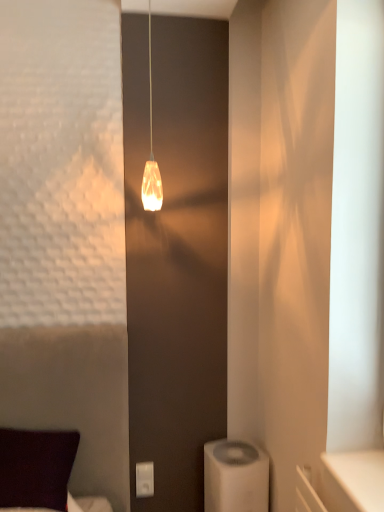
What do you see at coordinates (235, 477) in the screenshot? Image resolution: width=384 pixels, height=512 pixels. I see `white plastic air purifier at lower right` at bounding box center [235, 477].

What do you see at coordinates (144, 479) in the screenshot? I see `white plastic/light switch at lower center` at bounding box center [144, 479].

Locate an element on the screen. The image size is (384, 512). white plastic air purifier at lower right is located at coordinates (235, 477).

Does white plastic/light switch at lower center have a lesser height compared to white plastic air purifier at lower right?

Yes, white plastic/light switch at lower center is shorter than white plastic air purifier at lower right.

Measure the distance between white plastic/light switch at lower center and white plastic air purifier at lower right.

white plastic/light switch at lower center is 16.67 inches from white plastic air purifier at lower right.

Locate an element on the screen. light switch behind the white plastic air purifier at lower right is located at coordinates (144, 479).

Does point (144, 486) appear closer or farther from the camera than point (242, 510)?

Point (144, 486).

Can you see white plastic air purifier at lower right touching dark purple fabric pillow at lower left?

No.

Would you say white plastic air purifier at lower right is inside or outside dark purple fabric pillow at lower left?

white plastic air purifier at lower right is not enclosed by dark purple fabric pillow at lower left.

Visually, is white plastic air purifier at lower right positioned to the left or to the right of dark purple fabric pillow at lower left?

Based on their positions, white plastic air purifier at lower right is located to the right of dark purple fabric pillow at lower left.

From the image's perspective, which is below, white plastic air purifier at lower right or dark purple fabric pillow at lower left?

From the image's view, white plastic air purifier at lower right is below.

Considering the positions of point (143, 185) and point (148, 483), is point (143, 185) closer or farther from the camera than point (148, 483)?

Point (143, 185) appears to be closer to the viewer than point (148, 483).

Considering the sizes of translucent glass pendant light at center and white plastic/light switch at lower center in the image, is translucent glass pendant light at center wider or thinner than white plastic/light switch at lower center?

In the image, translucent glass pendant light at center appears to be wider than white plastic/light switch at lower center.

Looking at the image, does translucent glass pendant light at center seem bigger or smaller compared to white plastic/light switch at lower center?

translucent glass pendant light at center is bigger than white plastic/light switch at lower center.

How distant is translucent glass pendant light at center from white plastic/light switch at lower center?

The distance of translucent glass pendant light at center from white plastic/light switch at lower center is 4.33 feet.

From a real-world perspective, is translucent glass pendant light at center beneath dark purple fabric pillow at lower left?

No, from a real-world perspective, translucent glass pendant light at center is not beneath dark purple fabric pillow at lower left.

Does translucent glass pendant light at center touch dark purple fabric pillow at lower left?

No, translucent glass pendant light at center is not in contact with dark purple fabric pillow at lower left.

Does translucent glass pendant light at center have a lesser height compared to dark purple fabric pillow at lower left?

Incorrect, the height of translucent glass pendant light at center does not fall short of that of dark purple fabric pillow at lower left.

This screenshot has height=512, width=384. What are the coordinates of `pillow below the translucent glass pendant light at center (from the image's perspective)` in the screenshot? It's located at (36, 468).

From the image's perspective, between translucent glass pendant light at center and white plastic air purifier at lower right, which one is located above?

translucent glass pendant light at center, from the image's perspective.

Considering their positions, is translucent glass pendant light at center located in front of or behind white plastic air purifier at lower right?

Clearly, translucent glass pendant light at center is in front of white plastic air purifier at lower right.

Considering the relative positions of translucent glass pendant light at center and white plastic air purifier at lower right in the image provided, is translucent glass pendant light at center to the right of white plastic air purifier at lower right from the viewer's perspective?

Incorrect, translucent glass pendant light at center is not on the right side of white plastic air purifier at lower right.

Who is shorter, translucent glass pendant light at center or white plastic air purifier at lower right?

white plastic air purifier at lower right is shorter.

Which is behind, point (242, 494) or point (142, 465)?

The point (142, 465) is more distant.

Consider the image. Considering the relative sizes of white plastic air purifier at lower right and white plastic/light switch at lower center in the image provided, is white plastic air purifier at lower right taller than white plastic/light switch at lower center?

Yes, white plastic air purifier at lower right is taller than white plastic/light switch at lower center.

From the picture: Is white plastic air purifier at lower right inside the boundaries of white plastic/light switch at lower center, or outside?

white plastic air purifier at lower right is outside white plastic/light switch at lower center.

From a real-world perspective, is white plastic air purifier at lower right below translucent glass pendant light at center?

Yes, from a real-world perspective, white plastic air purifier at lower right is beneath translucent glass pendant light at center.

Locate an element on the screen. The image size is (384, 512). lamp that is in front of the white plastic air purifier at lower right is located at coordinates (151, 158).

Looking at this image, between white plastic air purifier at lower right and translucent glass pendant light at center, which one has larger size?

white plastic air purifier at lower right is bigger.

Is translucent glass pendant light at center completely or partially inside white plastic air purifier at lower right?

No, translucent glass pendant light at center is not surrounded by white plastic air purifier at lower right.

Find the location of a particular element. appliance in front of the white plastic/light switch at lower center is located at coordinates (235, 477).

Find the location of a particular element. pillow above the white plastic air purifier at lower right (from the image's perspective) is located at coordinates (36, 468).

Considering their positions, is white plastic/light switch at lower center positioned closer to white plastic air purifier at lower right than dark purple fabric pillow at lower left?

white plastic/light switch at lower center is closer to white plastic air purifier at lower right.

Considering their positions, is white plastic/light switch at lower center positioned closer to dark purple fabric pillow at lower left than translucent glass pendant light at center?

Based on the image, white plastic/light switch at lower center appears to be nearer to dark purple fabric pillow at lower left.

Based on their spatial positions, is white plastic air purifier at lower right or dark purple fabric pillow at lower left further from white plastic/light switch at lower center?

dark purple fabric pillow at lower left is further to white plastic/light switch at lower center.

Looking at the image, which one is located closer to white plastic air purifier at lower right, translucent glass pendant light at center or dark purple fabric pillow at lower left?

Among the two, dark purple fabric pillow at lower left is located nearer to white plastic air purifier at lower right.

Looking at the image, which one is located further to white plastic air purifier at lower right, dark purple fabric pillow at lower left or white plastic/light switch at lower center?

dark purple fabric pillow at lower left.

Estimate the real-world distances between objects in this image. Which object is closer to white plastic air purifier at lower right, white plastic/light switch at lower center or translucent glass pendant light at center?

white plastic/light switch at lower center.

From the image, which object appears to be nearer to dark purple fabric pillow at lower left, white plastic/light switch at lower center or white plastic air purifier at lower right?

white plastic/light switch at lower center.

Estimate the real-world distances between objects in this image. Which object is further from white plastic/light switch at lower center, dark purple fabric pillow at lower left or translucent glass pendant light at center?

translucent glass pendant light at center lies further to white plastic/light switch at lower center than the other object.

Identify the location of light switch that lies between translucent glass pendant light at center and white plastic air purifier at lower right from top to bottom. The width and height of the screenshot is (384, 512). (144, 479).

This screenshot has height=512, width=384. In order to click on light switch located between dark purple fabric pillow at lower left and white plastic air purifier at lower right in the left-right direction in this screenshot , I will do `click(144, 479)`.

Where is `pillow between translucent glass pendant light at center and white plastic/light switch at lower center vertically`? This screenshot has height=512, width=384. pillow between translucent glass pendant light at center and white plastic/light switch at lower center vertically is located at coordinates (36, 468).

Locate an element on the screen. Image resolution: width=384 pixels, height=512 pixels. pillow that lies between translucent glass pendant light at center and white plastic air purifier at lower right from top to bottom is located at coordinates (36, 468).